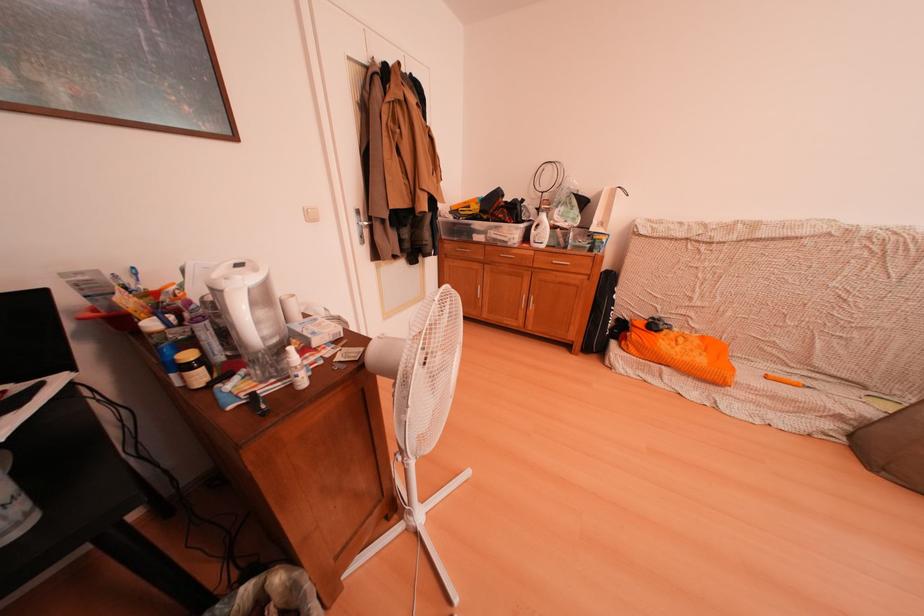
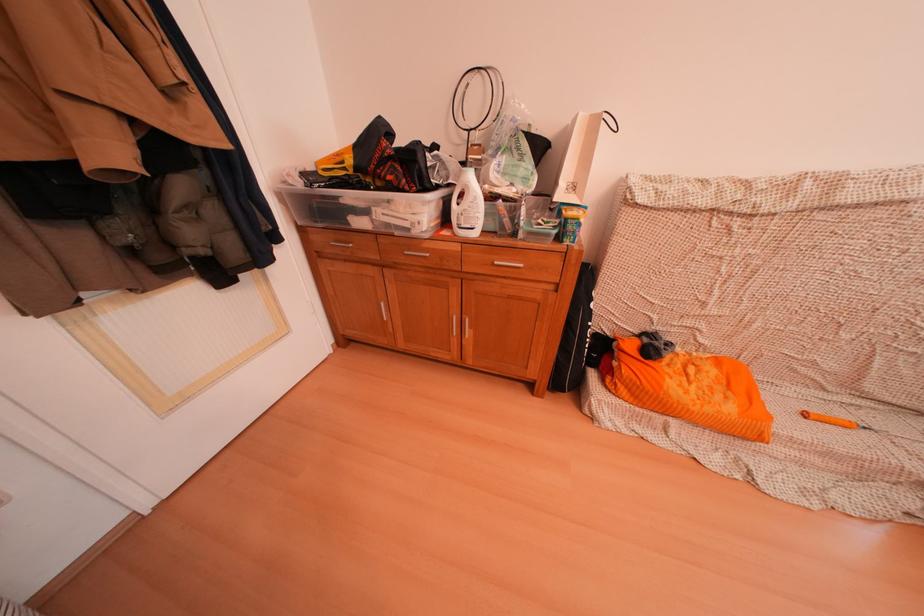
Locate, in the second image, the point that corresponds to (624,193) in the first image.

(603, 121)